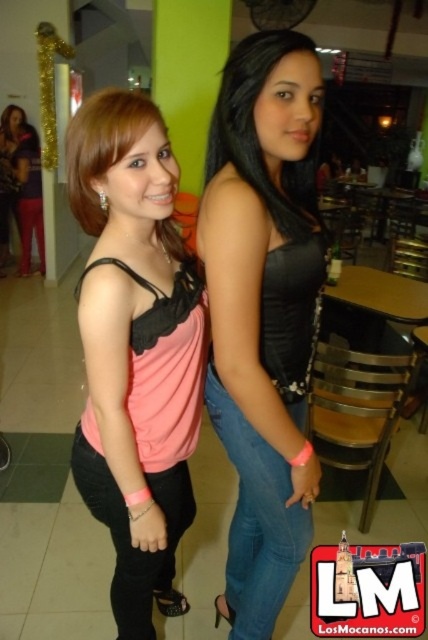
Between pink matte tank top at center and smooth black hair at center, which one is positioned higher?

smooth black hair at center is higher up.

Does pink matte tank top at center have a lesser height compared to smooth black hair at center?

No.

Between point (154, 413) and point (249, 104), which one is positioned in front?

Point (249, 104) is more forward.

The width and height of the screenshot is (428, 640). Identify the location of pink matte tank top at center. (134, 349).

Which is more to the right, pink matte tank top at center or matte purple top at left?

Positioned to the right is pink matte tank top at center.

Is point (174, 368) farther from camera compared to point (41, 211)?

No, (174, 368) is closer to viewer.

Does point (97, 275) come in front of point (26, 224)?

Yes, point (97, 275) is in front of point (26, 224).

At what (x,y) coordinates should I click in order to perform the action: click on pink matte tank top at center. Please return your answer as a coordinate pair (x, y). Image resolution: width=428 pixels, height=640 pixels. Looking at the image, I should click on (134, 349).

Who is more distant from viewer, (282, 259) or (134, 595)?

Point (134, 595)

The width and height of the screenshot is (428, 640). What do you see at coordinates (262, 310) in the screenshot? I see `black matte tank top at center` at bounding box center [262, 310].

This screenshot has width=428, height=640. I want to click on black matte tank top at center, so click(262, 310).